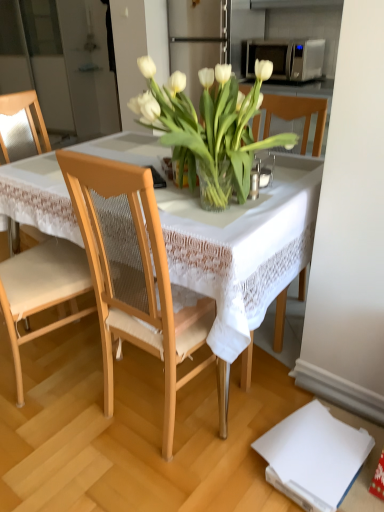
Question: Is there a large distance between satin silver microwave at upper right and translucent glass vase at center?

Choices:
 (A) yes
 (B) no

Answer: (A)

Question: Considering the relative positions of satin silver microwave at upper right and translucent glass vase at center in the image provided, is satin silver microwave at upper right to the right of translucent glass vase at center from the viewer's perspective?

Choices:
 (A) yes
 (B) no

Answer: (A)

Question: From the image's perspective, does satin silver microwave at upper right appear higher than translucent glass vase at center?

Choices:
 (A) no
 (B) yes

Answer: (B)

Question: Does satin silver microwave at upper right turn towards translucent glass vase at center?

Choices:
 (A) no
 (B) yes

Answer: (B)

Question: Is satin silver microwave at upper right bigger than translucent glass vase at center?

Choices:
 (A) no
 (B) yes

Answer: (A)

Question: Does point (16, 114) appear closer or farther from the camera than point (205, 253)?

Choices:
 (A) farther
 (B) closer

Answer: (A)

Question: From a real-world perspective, is light wood mesh chair at left, marked as the first chair in a back-to-front arrangement, above or below white lace tablecloth at center?

Choices:
 (A) above
 (B) below

Answer: (A)

Question: Considering their positions, is light wood mesh chair at left, acting as the 2th chair starting from the front, located in front of or behind white lace tablecloth at center?

Choices:
 (A) behind
 (B) front

Answer: (A)

Question: Looking at their shapes, would you say light wood mesh chair at left, marked as the first chair in a back-to-front arrangement, is wider or thinner than white lace tablecloth at center?

Choices:
 (A) thin
 (B) wide

Answer: (A)

Question: Looking at the image, does white lace tablecloth at center seem bigger or smaller compared to light wood chair at center, positioned as the 1th chair in right-to-left order?

Choices:
 (A) big
 (B) small

Answer: (A)

Question: From the image's perspective, relative to light wood chair at center, which appears as the second chair when viewed from the back, is white lace tablecloth at center above or below?

Choices:
 (A) below
 (B) above

Answer: (B)

Question: Is white lace tablecloth at center to the left or to the right of light wood chair at center, which appears as the second chair when viewed from the back, in the image?

Choices:
 (A) right
 (B) left

Answer: (B)

Question: Considering the positions of point (281, 276) and point (178, 381), is point (281, 276) closer or farther from the camera than point (178, 381)?

Choices:
 (A) closer
 (B) farther

Answer: (A)

Question: Considering their positions, is light wood chair at center, which ranks as the second chair in left-to-right order, located in front of or behind light wood mesh chair at left, which ranks as the first chair in left-to-right order?

Choices:
 (A) behind
 (B) front

Answer: (B)

Question: Considering the positions of light wood chair at center, which appears as the second chair when viewed from the back, and light wood mesh chair at left, which ranks as the first chair in left-to-right order, in the image, is light wood chair at center, which appears as the second chair when viewed from the back, wider or thinner than light wood mesh chair at left, which ranks as the first chair in left-to-right order,?

Choices:
 (A) wide
 (B) thin

Answer: (B)